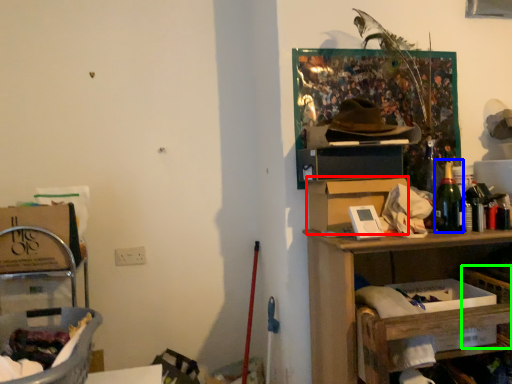
Question: Which object is positioned closest to cardboard box (highlighted by a red box)? Select from bottle (highlighted by a blue box) and basket (highlighted by a green box).

Choices:
 (A) bottle
 (B) basket

Answer: (A)